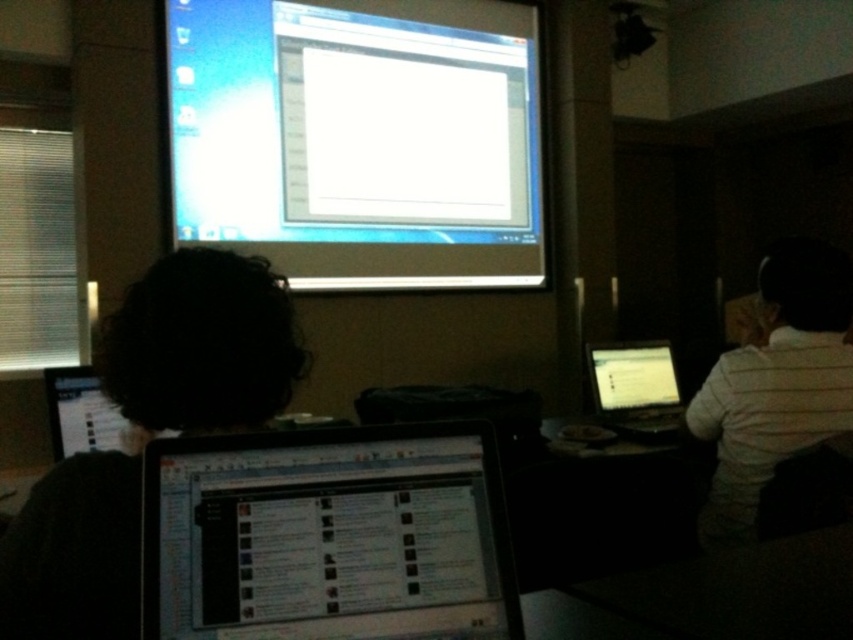
You are a technician who needs to set up a projector that requires a minimum distance of 3 meters to function properly. You are standing at the camera position and want to project onto the white glossy projector screen at upper center. Based on the scene description, will the projector work effectively from your current position?

The white glossy projector screen at upper center and camera are 3.40 meters apart from each other. Since the required minimum distance is 3 meters, the projector will work effectively from the current position.

You are standing in the room and want to project a presentation onto the white glossy projector screen at upper center. Based on its position, can you estimate where you should aim the projector to ensure the image is centered on the screen?

The white glossy projector screen at upper center is located at coordinates approximately 0.217 on the x axis and 0.422 on the y axis, so you should aim the projector towards those coordinates to center the image on the screen.